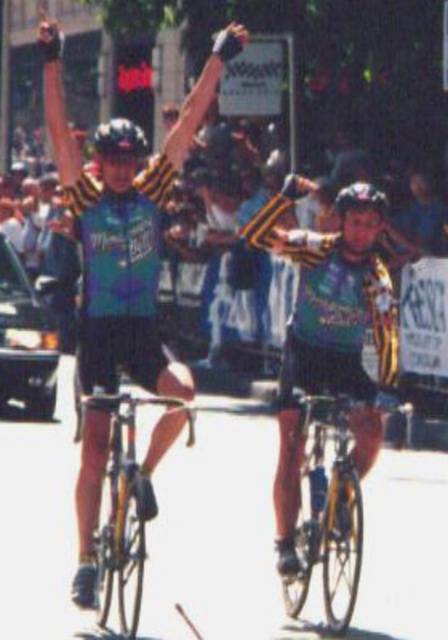
You are a photographer standing at the origin point of the coordinate system. You want to take a photo of the yellow matte bicycle at center. What are the coordinates where you should aim your camera?

The yellow matte bicycle at center is located at coordinates point (327, 509). You should aim your camera at those coordinates to capture the bicycle.

You are a photographer who wants to capture a closeup of the yellow matte bicycle at center. Given that your camera can only focus on objects within a 0.2 unit radius around point (327, 509), will the yellow matte bicycle at center be in focus?

The yellow matte bicycle at center is located exactly at point (327, 509), so it will be in focus since it is within the 0.2 unit radius.